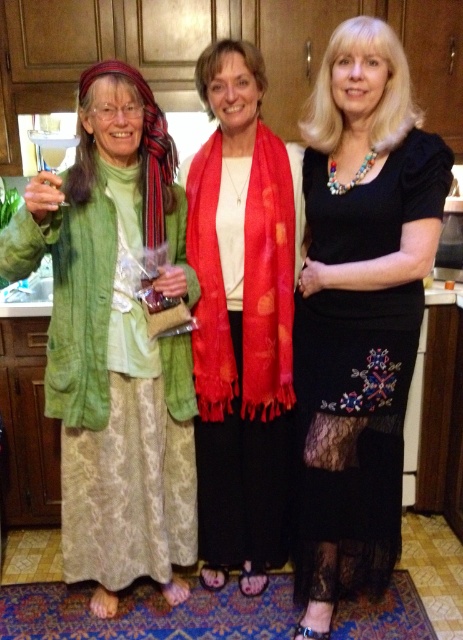
Is black lace dress at center bigger than silky red scarf at center?

Correct, black lace dress at center is larger in size than silky red scarf at center.

Does black lace dress at center have a greater height compared to silky red scarf at center?

Correct, black lace dress at center is much taller as silky red scarf at center.

Locate an element on the screen. The height and width of the screenshot is (640, 463). black lace dress at center is located at coordinates (358, 310).

Which is in front, point (118, 337) or point (269, 397)?

Point (118, 337) is in front.

Can you confirm if green textured cardigan at left is positioned to the right of silky red scarf at center?

Incorrect, green textured cardigan at left is not on the right side of silky red scarf at center.

Which is behind, point (68, 432) or point (293, 170)?

The point (293, 170) is behind.

Image resolution: width=463 pixels, height=640 pixels. Find the location of `green textured cardigan at left`. green textured cardigan at left is located at coordinates (114, 342).

Does green textured cardigan at left have a greater height compared to black lace dress at center?

In fact, green textured cardigan at left may be shorter than black lace dress at center.

Does green textured cardigan at left appear under black lace dress at center?

Correct, green textured cardigan at left is located below black lace dress at center.

Is point (155, 566) positioned behind point (369, 122)?

Yes.

Where is `green textured cardigan at left`? The width and height of the screenshot is (463, 640). green textured cardigan at left is located at coordinates (114, 342).